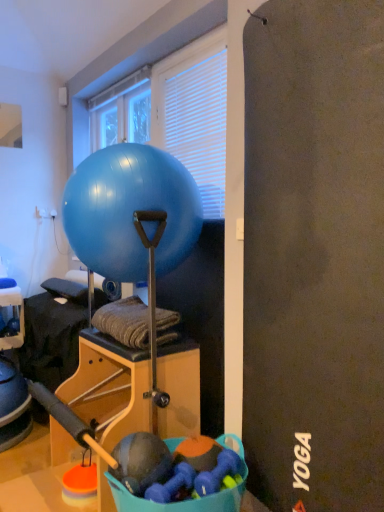
Question: Is blue glossy exercise ball at center taller or shorter than transparent glass window at upper center?

Choices:
 (A) tall
 (B) short

Answer: (A)

Question: Does point (109, 221) appear closer or farther from the camera than point (135, 140)?

Choices:
 (A) farther
 (B) closer

Answer: (B)

Question: Which object is the farthest from the blue glossy exercise ball at center?

Choices:
 (A) white blinds at upper center
 (B) transparent glass window at upper center

Answer: (B)

Question: Considering the real-world distances, which object is farthest from the transparent glass window at upper center?

Choices:
 (A) blue glossy exercise ball at center
 (B) white blinds at upper center

Answer: (A)